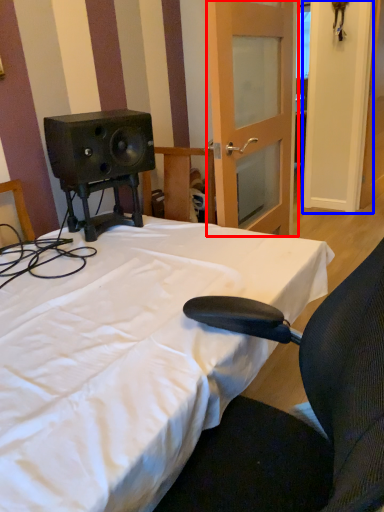
Question: Among these objects, which one is farthest to the camera, door (highlighted by a red box) or door (highlighted by a blue box)?

Choices:
 (A) door
 (B) door

Answer: (B)